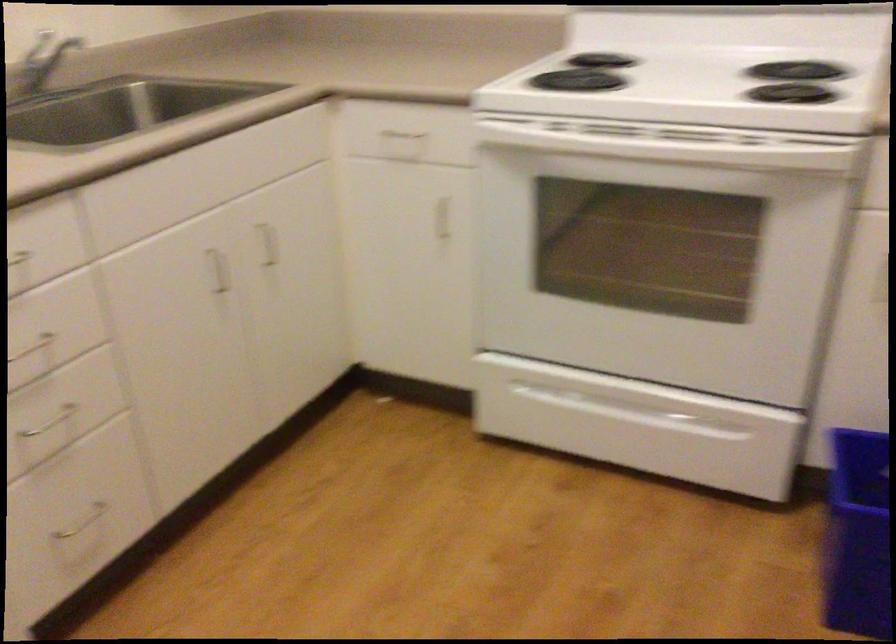
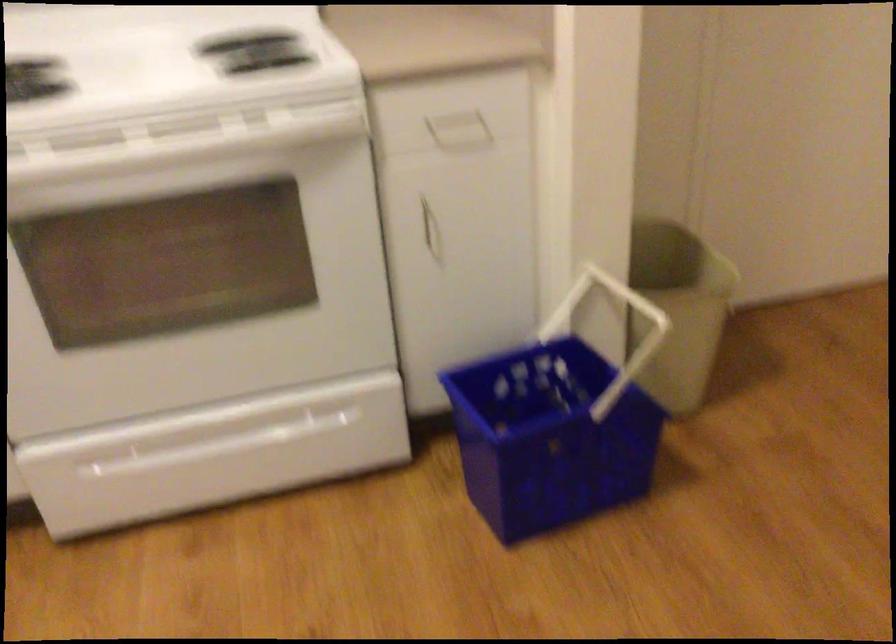
The point at (673,147) is marked in the first image. Where is the corresponding point in the second image?

(175, 143)